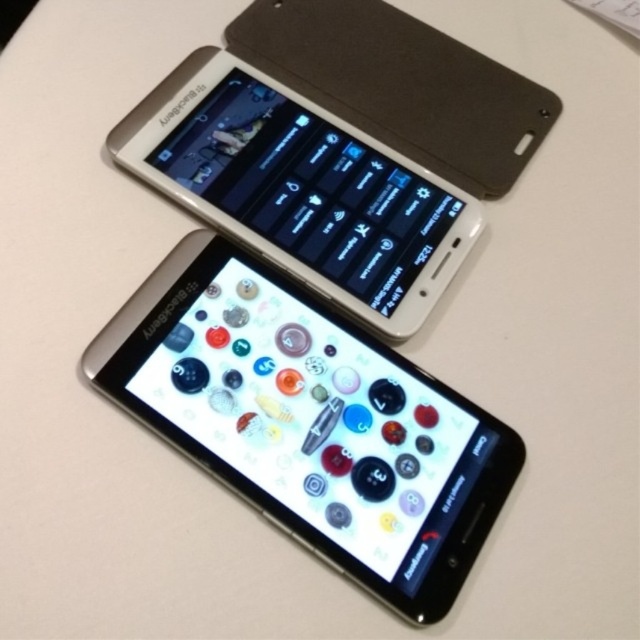
Question: Can you confirm if silver metallic smartphone at center is positioned to the left of matte black smartphone at upper center?

Choices:
 (A) yes
 (B) no

Answer: (A)

Question: Which object is the farthest from the satin silver phone at upper center?

Choices:
 (A) matte black smartphone at upper center
 (B) silver metallic smartphone at center

Answer: (B)

Question: Among these points, which one is farthest from the camera?

Choices:
 (A) (211, 180)
 (B) (449, 426)
 (C) (518, 170)

Answer: (C)

Question: From the image, what is the correct spatial relationship of satin silver phone at upper center in relation to matte black smartphone at upper center?

Choices:
 (A) right
 (B) left

Answer: (B)

Question: Can you confirm if silver metallic smartphone at center is wider than matte black smartphone at upper center?

Choices:
 (A) yes
 (B) no

Answer: (A)

Question: Which of the following is the closest to the observer?

Choices:
 (A) (365, 65)
 (B) (305, 168)

Answer: (B)